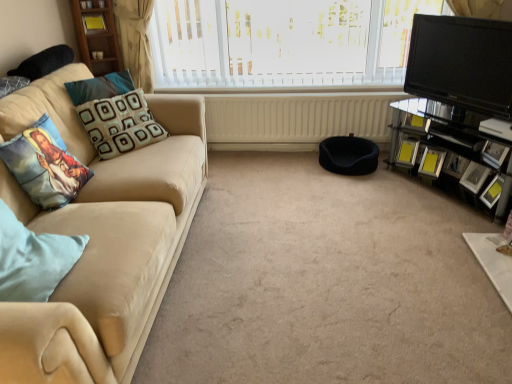
I want to click on vacant space in between white glossy table at lower right and black fabric footrest at center, so click(x=418, y=213).